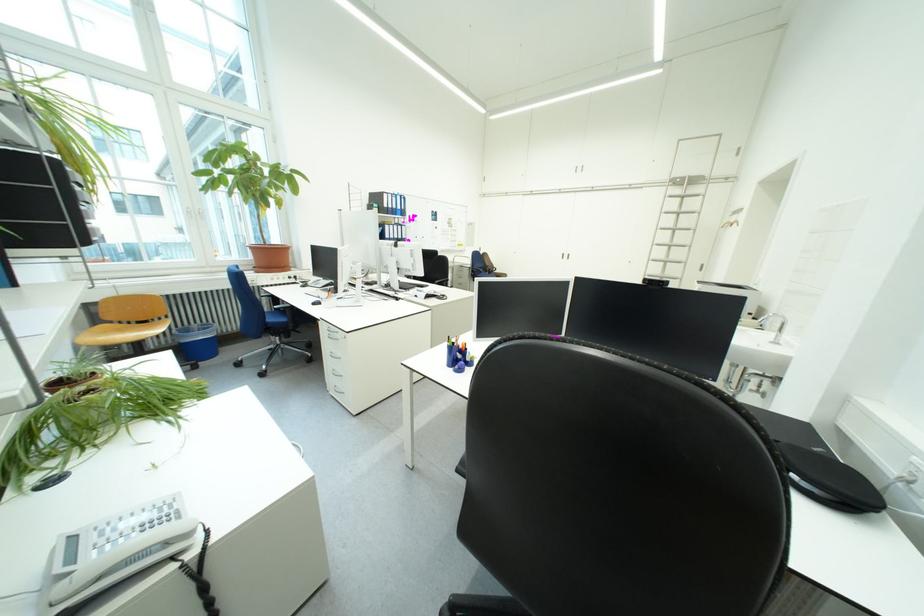
The image size is (924, 616). What are the coordinates of `ladder rung` in the screenshot? It's located at (x=681, y=209).